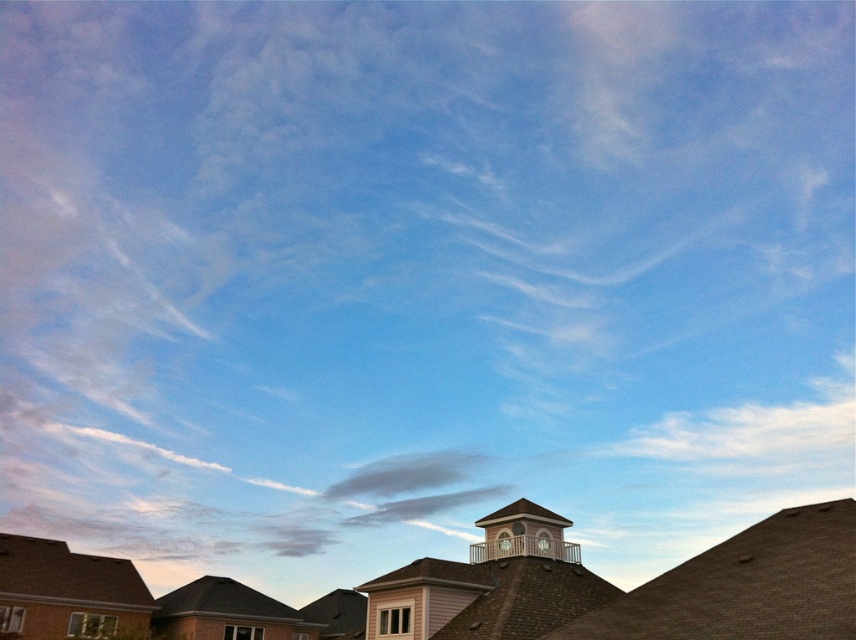
What do you see at coordinates (66, 572) in the screenshot?
I see `brown shingles at lower left` at bounding box center [66, 572].

Who is lower down, brown shingles at lower left or white wooden bell tower at center?

Positioned lower is brown shingles at lower left.

Between point (49, 572) and point (488, 525), which one is positioned behind?

Point (49, 572)

You are a GUI agent. You are given a task and a screenshot of the screen. Output one action in this format:
    pyautogui.click(x=<x>, y=<y>)
    Task: Click on the brown shingles at lower left
    This screenshot has height=640, width=856.
    Given the screenshot: What is the action you would take?
    pyautogui.click(x=66, y=572)

Is brown shingles at lower left further to the viewer compared to matte white clock at upper center?

Yes, brown shingles at lower left is further from the viewer.

Is brown shingles at lower left below matte white clock at upper center?

Yes, brown shingles at lower left is below matte white clock at upper center.

Between point (70, 593) and point (542, 532), which one is positioned in front?

Positioned in front is point (542, 532).

Locate an element on the screen. brown shingles at lower left is located at coordinates (66, 572).

The height and width of the screenshot is (640, 856). Identify the location of matte white clock at upper center. (544, 544).